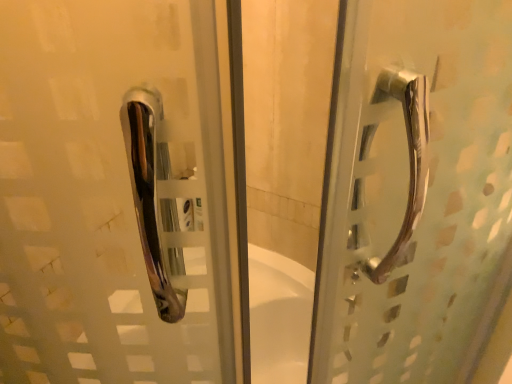
Measure the distance between point (436, 153) and camera.

A distance of 38.80 centimeters exists between point (436, 153) and camera.

Describe the element at coordinates (415, 193) in the screenshot. I see `polished metal handle at right` at that location.

The width and height of the screenshot is (512, 384). I want to click on polished metal handle at right, so click(x=415, y=193).

Looking at this image, what is the approximate width of polished metal handle at right?

It is 3.21 inches.

Where is `polished metal handle at right`? The height and width of the screenshot is (384, 512). polished metal handle at right is located at coordinates (415, 193).